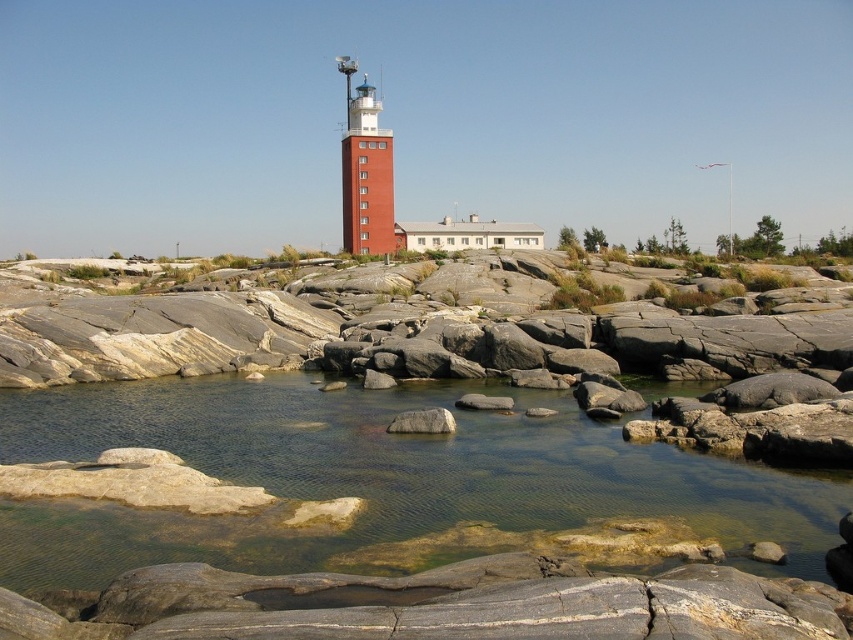
Who is more distant from viewer, (345, 100) or (506, 406)?

The point (345, 100) is behind.

Is point (387, 209) more distant than point (454, 403)?

Yes, it is behind point (454, 403).

Identify the location of red brick tower at center. (364, 170).

Is point (67, 548) closer to camera compared to point (409, 422)?

Yes, it is.

Is point (532, 403) closer to viewer compared to point (434, 429)?

No, (532, 403) is behind (434, 429).

The image size is (853, 640). What are the coordinates of `clear water at center` in the screenshot? It's located at (378, 476).

Is clear water at center behind red brick tower at center?

That is False.

Which of these two, clear water at center or red brick tower at center, stands taller?

red brick tower at center is taller.

Where is `clear water at center`? clear water at center is located at coordinates (378, 476).